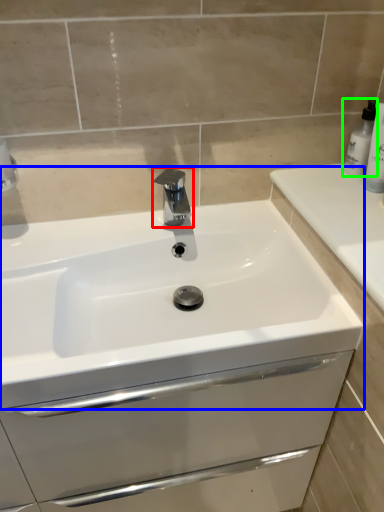
Question: Which object is the closest to the tap (highlighted by a red box)? Choose among these: sink (highlighted by a blue box) or soap dispenser (highlighted by a green box).

Choices:
 (A) sink
 (B) soap dispenser

Answer: (A)